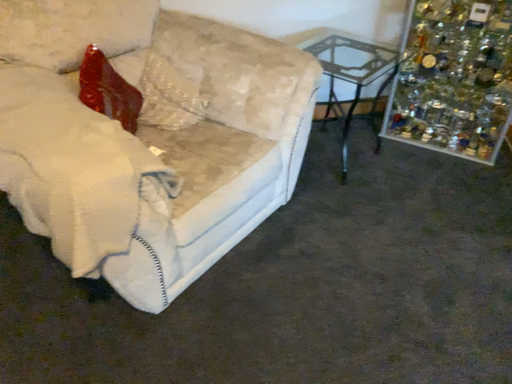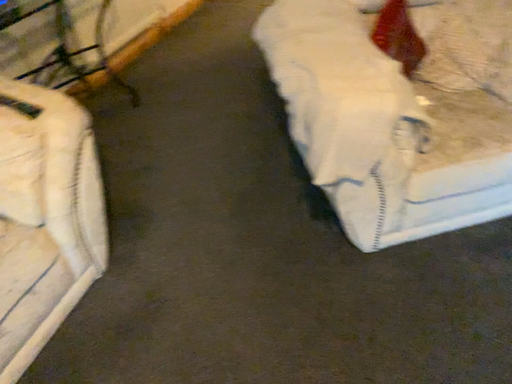
Question: Which way did the camera rotate in the video?

Choices:
 (A) rotated left
 (B) rotated right

Answer: (A)